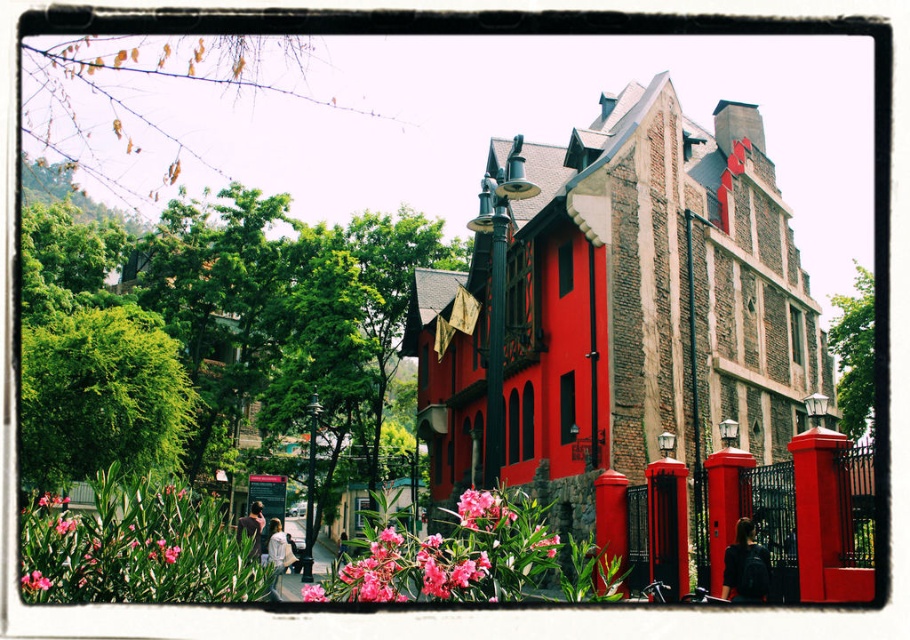
You are a city planner assessing the urban space in front of the red building. You need to install a new sign that must be shorter than the green matte lamp post at center. Can the pink matte flower at lower left be used as a reference point for the sign height? Explain your reasoning.

The green matte lamp post at center is taller than the pink matte flower at lower left. Since the pink matte flower at lower left is shorter than the lamp post, the sign can be designed to match or be shorter than the flower to ensure it meets the requirement of being shorter than the lamp post.

You are standing at the point marked by the coordinates point (498, 291) in the image. What object are you standing on?

The point (498, 291) marks the green matte lamp post at center, so you are standing on the green matte lamp post at center.